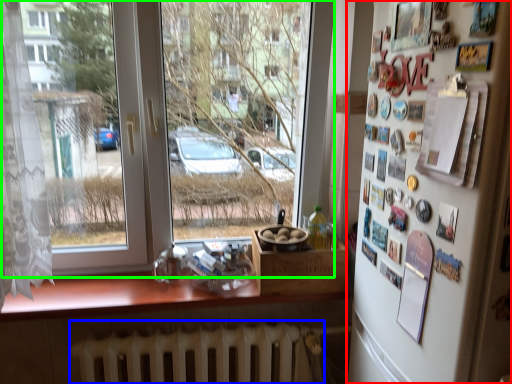
Question: Which object is the farthest from mirror (highlighted by a red box)? Choose among these: radiator (highlighted by a blue box) or window (highlighted by a green box).

Choices:
 (A) radiator
 (B) window

Answer: (B)